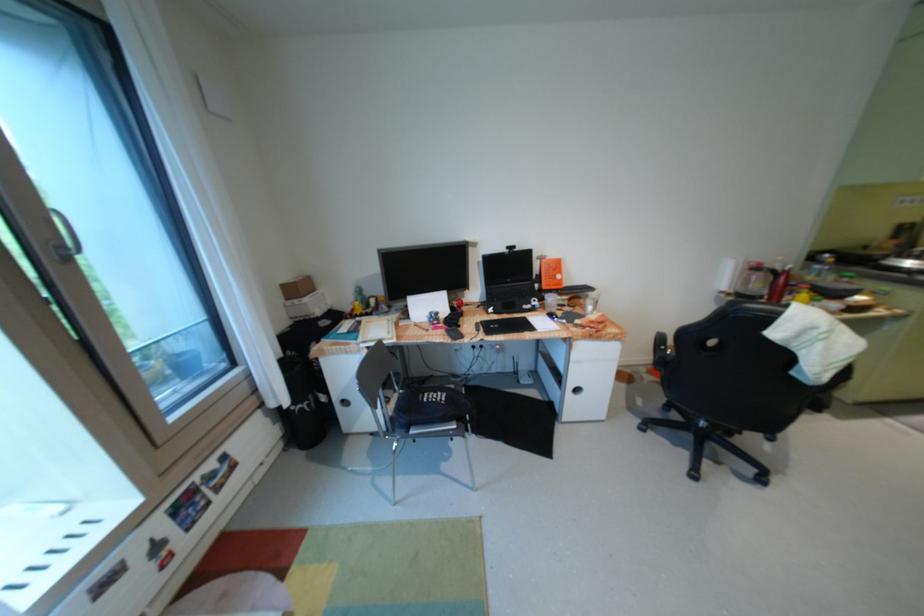
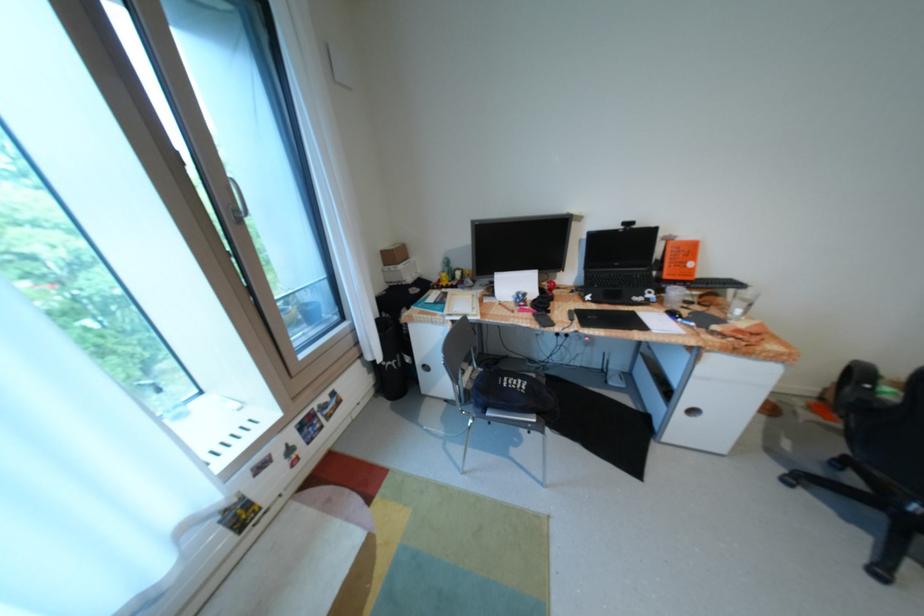
Where in the second image is the point corresponding to point 312,405 from the first image?

(402, 363)